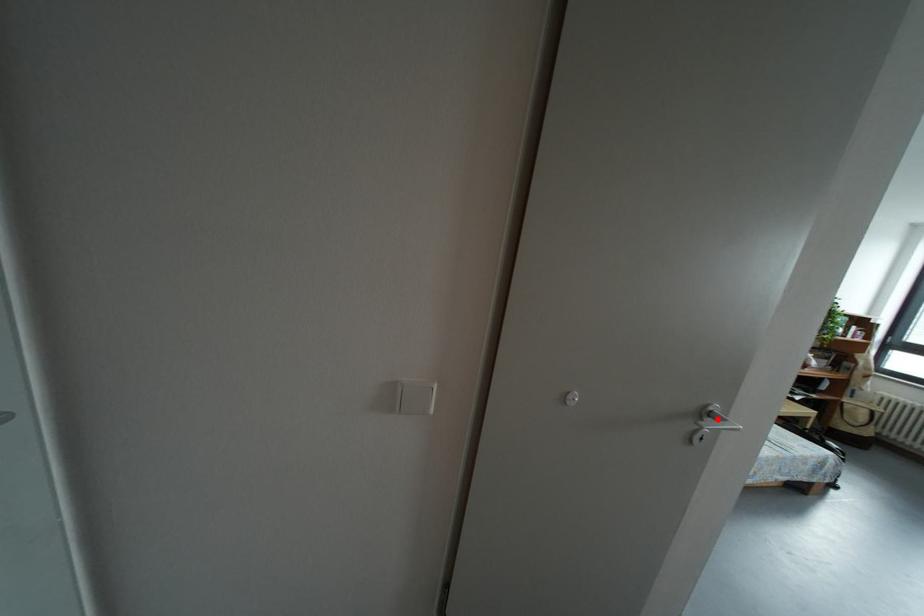
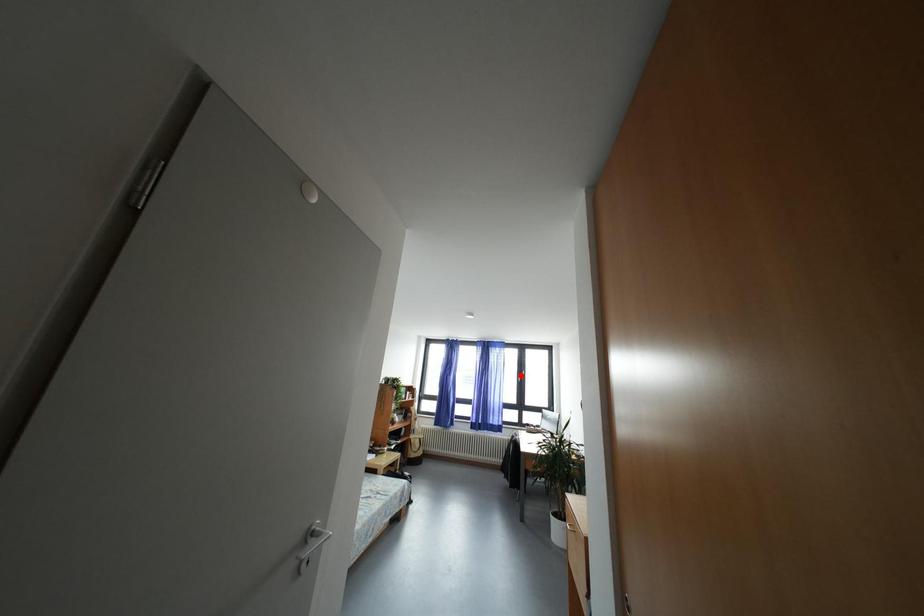
I am providing you with two images of the same scene from different viewpoints. A red point is marked on the first image and another point is marked on the second image. Is the marked point in image1 the same physical position as the marked point in image2?

No